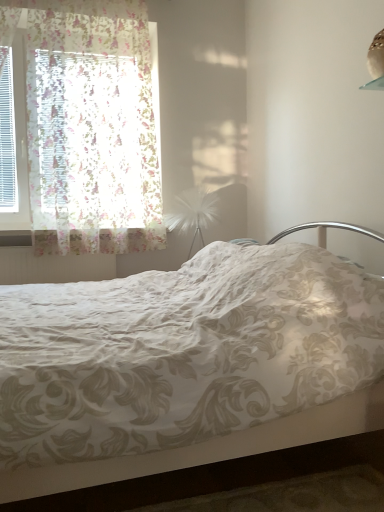
Question: From a real-world perspective, is floral lace curtain at left physically above white floral fabric bed at center?

Choices:
 (A) yes
 (B) no

Answer: (A)

Question: Can you confirm if floral lace curtain at left is positioned to the right of white floral fabric bed at center?

Choices:
 (A) yes
 (B) no

Answer: (B)

Question: Can you confirm if floral lace curtain at left is bigger than white floral fabric bed at center?

Choices:
 (A) yes
 (B) no

Answer: (B)

Question: Can you confirm if floral lace curtain at left is wider than white floral fabric bed at center?

Choices:
 (A) no
 (B) yes

Answer: (A)

Question: Considering the relative sizes of floral lace curtain at left and white floral fabric bed at center in the image provided, is floral lace curtain at left shorter than white floral fabric bed at center?

Choices:
 (A) no
 (B) yes

Answer: (A)

Question: In terms of width, does floral lace curtain at left look wider or thinner when compared to metallic silver headboard at upper right?

Choices:
 (A) wide
 (B) thin

Answer: (B)

Question: In terms of height, does floral lace curtain at left look taller or shorter compared to metallic silver headboard at upper right?

Choices:
 (A) short
 (B) tall

Answer: (B)

Question: Considering the relative positions of floral lace curtain at left and metallic silver headboard at upper right in the image provided, is floral lace curtain at left to the left or to the right of metallic silver headboard at upper right?

Choices:
 (A) left
 (B) right

Answer: (A)

Question: In terms of size, does floral lace curtain at left appear bigger or smaller than metallic silver headboard at upper right?

Choices:
 (A) small
 (B) big

Answer: (B)

Question: Is white feather at center to the left or to the right of pearl white feather at upper right in the image?

Choices:
 (A) right
 (B) left

Answer: (B)

Question: From a real-world perspective, relative to pearl white feather at upper right, is white feather at center vertically above or below?

Choices:
 (A) above
 (B) below

Answer: (B)

Question: Looking at their shapes, would you say white feather at center is wider or thinner than pearl white feather at upper right?

Choices:
 (A) wide
 (B) thin

Answer: (A)

Question: Is point (206, 212) closer or farther from the camera than point (382, 69)?

Choices:
 (A) closer
 (B) farther

Answer: (B)

Question: In terms of width, does pearl white feather at upper right look wider or thinner when compared to metallic silver headboard at upper right?

Choices:
 (A) wide
 (B) thin

Answer: (B)

Question: From a real-world perspective, is pearl white feather at upper right positioned above or below metallic silver headboard at upper right?

Choices:
 (A) below
 (B) above

Answer: (B)